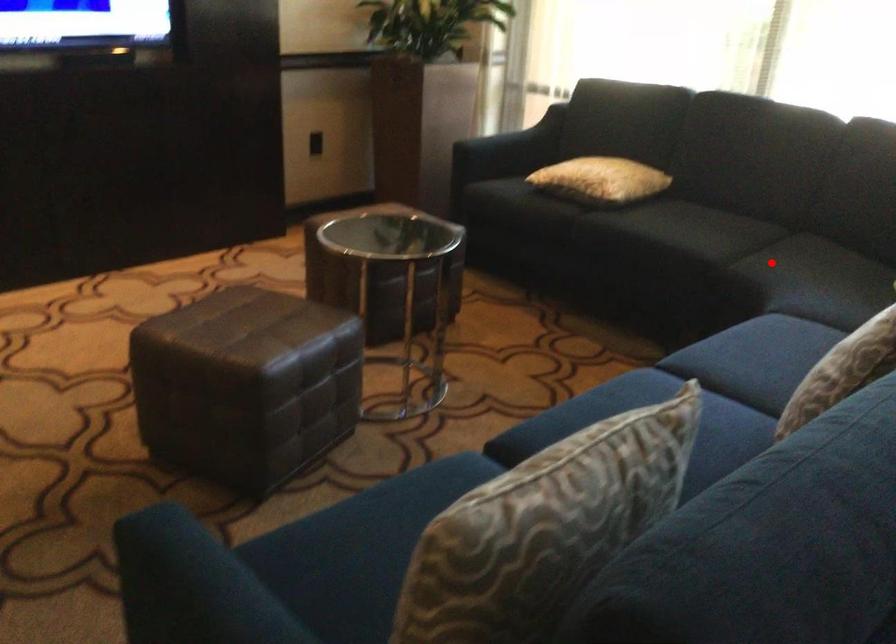
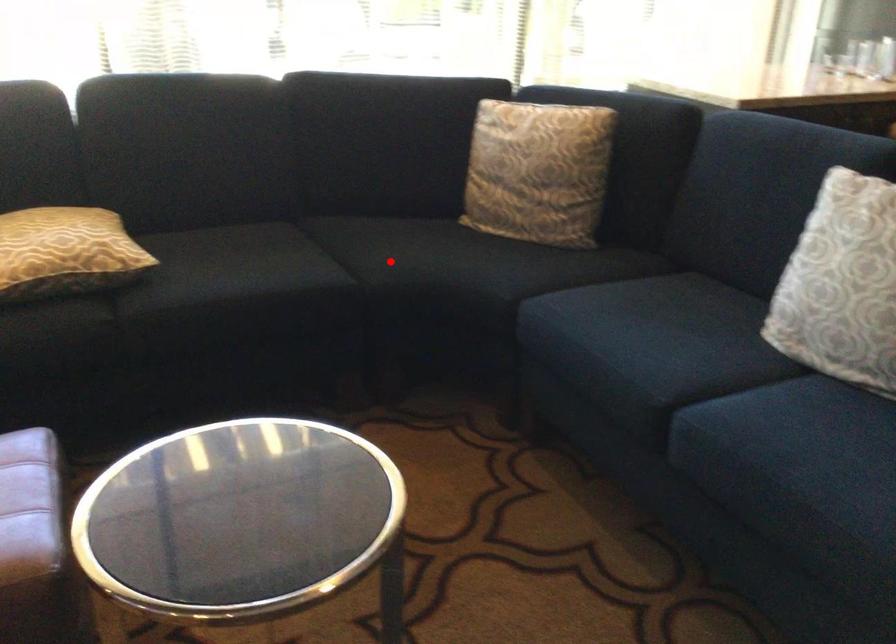
I am providing you with two images of the same scene from different viewpoints. A red point is marked on the first image and another point is marked on the second image. Is the marked point in image1 the same physical position as the marked point in image2?

Yes